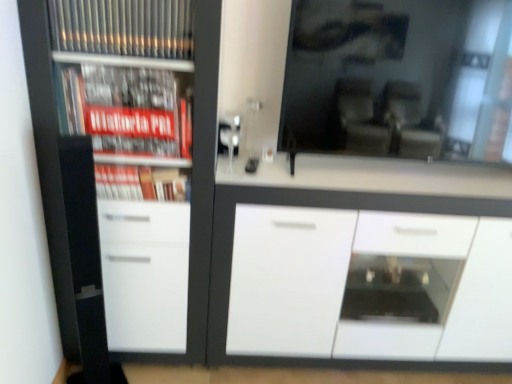
This screenshot has height=384, width=512. In order to click on vacant space underneath transparent glass mirror at upper center (from a real-world perspective) in this screenshot , I will do `click(418, 174)`.